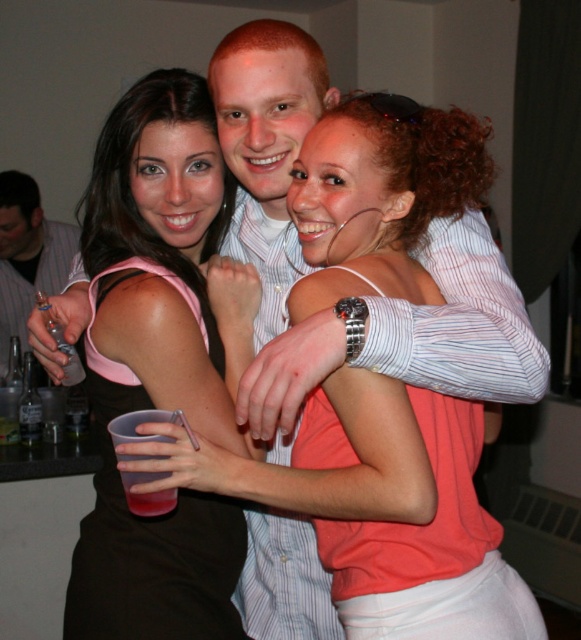
Question: Considering the relative positions of black fabric dress at center and brushed metal can at left in the image provided, where is black fabric dress at center located with respect to brushed metal can at left?

Choices:
 (A) right
 (B) left

Answer: (A)

Question: Observing the image, what is the correct spatial positioning of black fabric dress at center in reference to brushed metal can at left?

Choices:
 (A) below
 (B) above

Answer: (A)

Question: Among these objects, which one is nearest to the camera?

Choices:
 (A) black fabric dress at center
 (B) brushed metal can at left

Answer: (A)

Question: Can you confirm if black fabric dress at center is wider than brushed metal can at left?

Choices:
 (A) no
 (B) yes

Answer: (A)

Question: Which of the following is the farthest from the observer?

Choices:
 (A) brushed metal can at left
 (B) black fabric dress at center

Answer: (A)